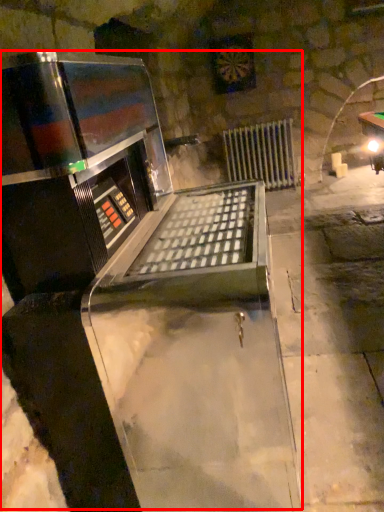
Question: From the image's perspective, what is the correct spatial positioning of wine cellar (annotated by the red box) in reference to radiator?

Choices:
 (A) below
 (B) above

Answer: (A)